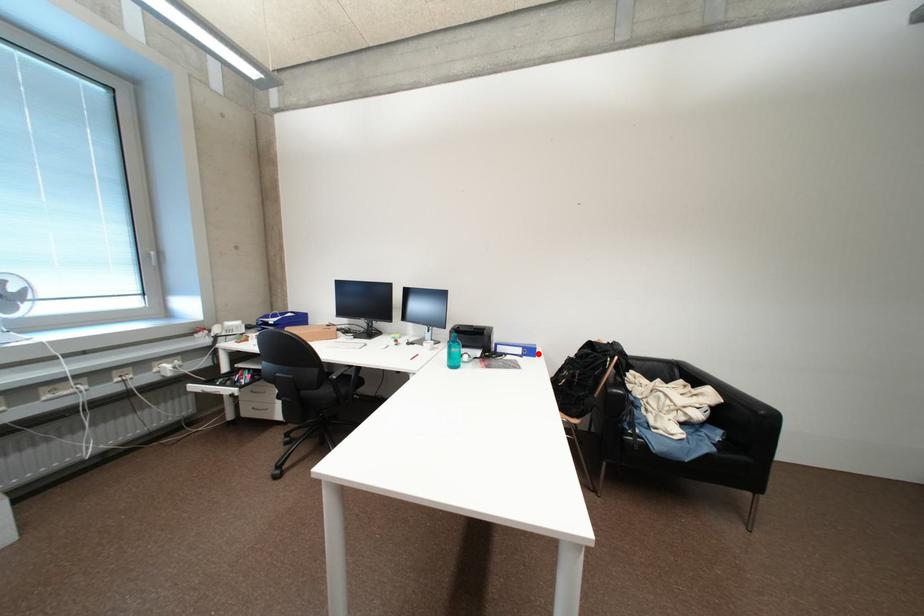
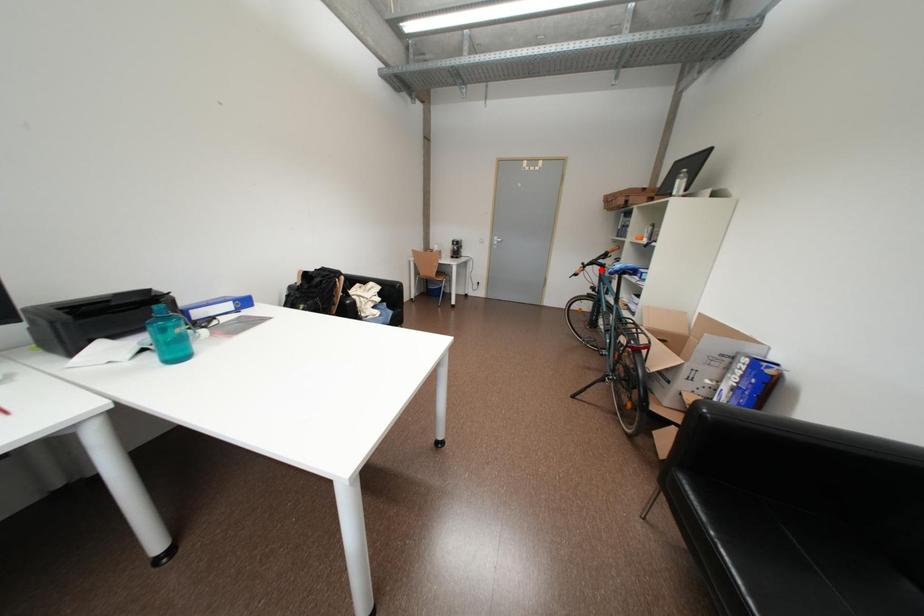
Based on the photo, I am providing you with two images of the same scene from different viewpoints. A red point is marked on the first image and another point is marked on the second image. Is the red point in image1 aligned with the point shown in image2?

No